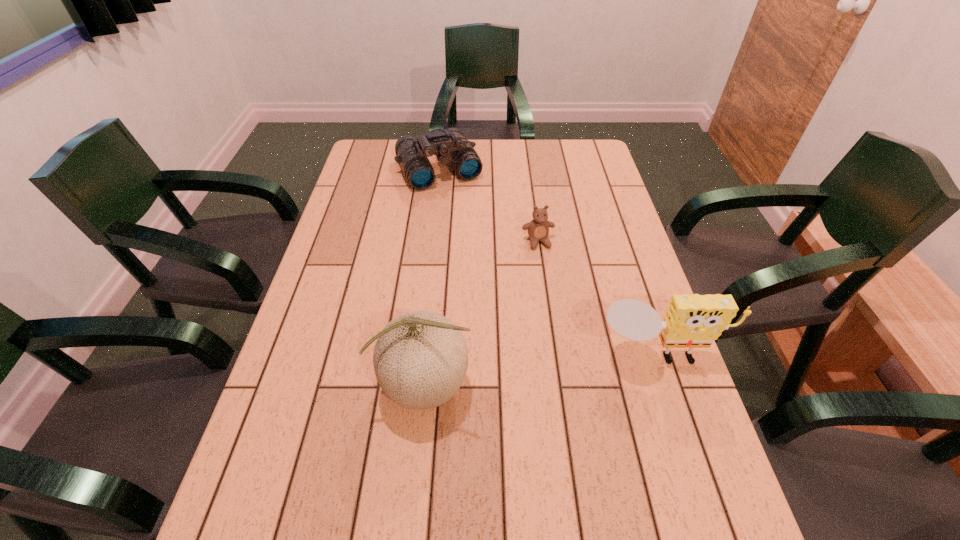
This screenshot has width=960, height=540. What are the coordinates of `cantaloup` in the screenshot? It's located at (420, 359).

Where is `the rightmost object`? the rightmost object is located at coordinates (691, 321).

This screenshot has width=960, height=540. Identify the location of the second tallest object. (691, 321).

Find the location of `the third nearest object`. the third nearest object is located at coordinates (538, 229).

Locate an element on the screen. The height and width of the screenshot is (540, 960). teddy bear is located at coordinates (538, 229).

Locate an element on the screen. This screenshot has width=960, height=540. the second shortest object is located at coordinates (450, 145).

The height and width of the screenshot is (540, 960). Identify the location of the farthest object. (450, 145).

Where is `free spot located 0.220m on the back of the tallest object`? free spot located 0.220m on the back of the tallest object is located at coordinates (435, 282).

You are a GUI agent. You are given a task and a screenshot of the screen. Output one action in this format:
    pyautogui.click(x=<x>, y=<y>)
    Task: Click on the vacant space located on the front-facing side of the third shortest object
    This screenshot has height=540, width=960.
    Given the screenshot: What is the action you would take?
    pyautogui.click(x=690, y=446)

The height and width of the screenshot is (540, 960). I want to click on vacant area located on the front-facing side of the second object from right to left, so click(548, 273).